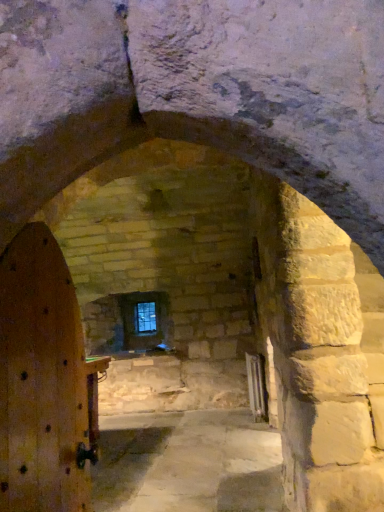
Question: Considering their positions, is wooden door at left located in front of or behind clear glass window at center?

Choices:
 (A) behind
 (B) front

Answer: (B)

Question: Visually, is wooden door at left positioned to the left or to the right of clear glass window at center?

Choices:
 (A) left
 (B) right

Answer: (B)

Question: Is point (1, 494) positioned closer to the camera than point (137, 309)?

Choices:
 (A) farther
 (B) closer

Answer: (B)

Question: Looking at their shapes, would you say clear glass window at center is wider or thinner than wooden door at left?

Choices:
 (A) wide
 (B) thin

Answer: (B)

Question: From the image's perspective, relative to wooden door at left, is clear glass window at center above or below?

Choices:
 (A) below
 (B) above

Answer: (A)

Question: Is clear glass window at center spatially inside wooden door at left, or outside of it?

Choices:
 (A) outside
 (B) inside

Answer: (A)

Question: In the image, is clear glass window at center positioned in front of or behind wooden door at left?

Choices:
 (A) behind
 (B) front

Answer: (A)